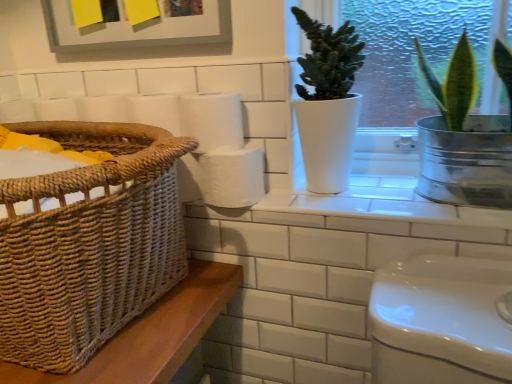
Locate an element on the screen. free space in front of white matte pot at center, the second houseplant positioned from the right is located at coordinates (365, 208).